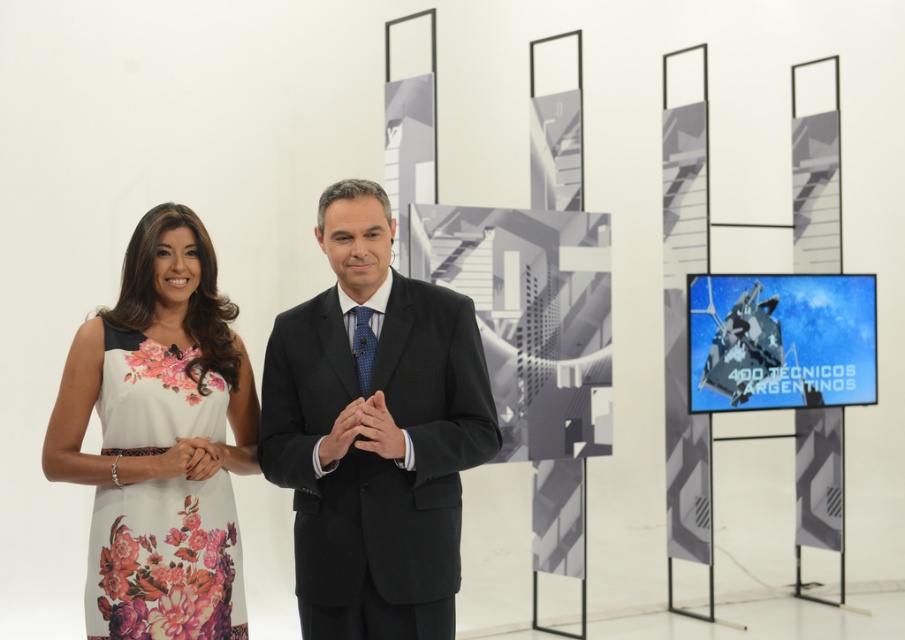
Does black suit at center come behind floral printed fabric dress at left?

No.

Can you confirm if black suit at center is bigger than floral printed fabric dress at left?

Correct, black suit at center is larger in size than floral printed fabric dress at left.

What do you see at coordinates (374, 432) in the screenshot?
I see `black suit at center` at bounding box center [374, 432].

The image size is (905, 640). In order to click on black suit at center in this screenshot , I will do `click(374, 432)`.